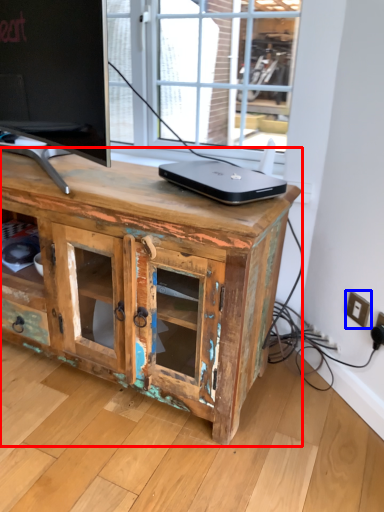
Question: Among these objects, which one is farthest to the camera, chest of drawers (highlighted by a red box) or electric outlet (highlighted by a blue box)?

Choices:
 (A) chest of drawers
 (B) electric outlet

Answer: (B)